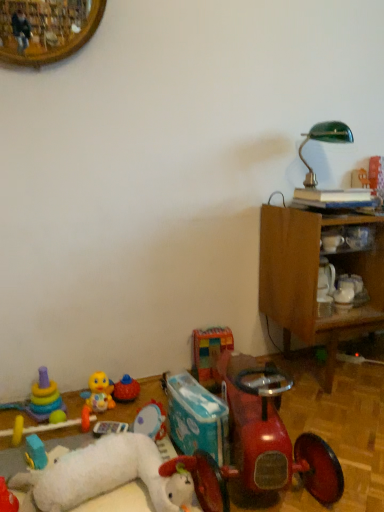
Find the location of a particular element. This screenshot has width=384, height=512. free space in front of rubberized orange ball at center, the 7th toy positioned from the left is located at coordinates (122, 413).